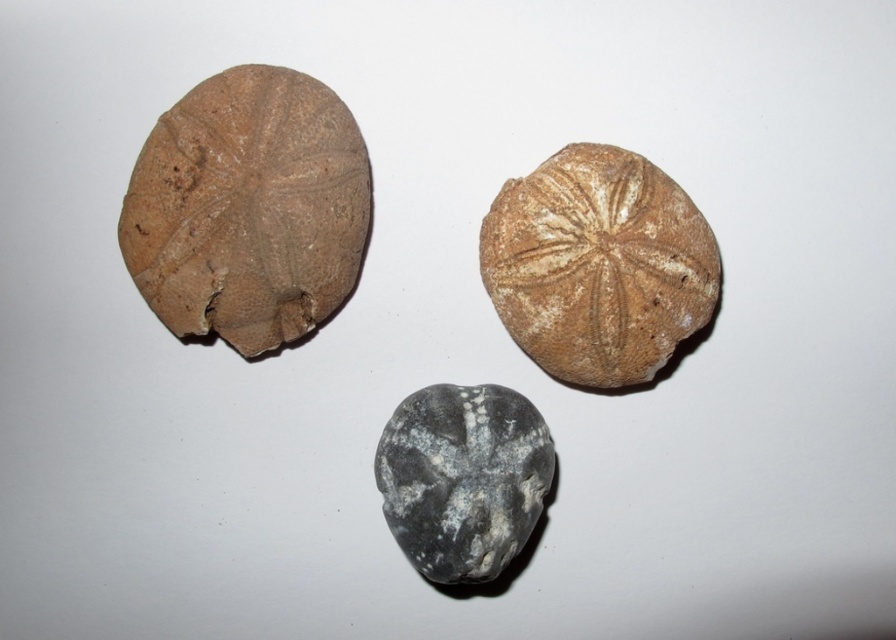
Question: Considering the real-world distances, which object is farthest from the gray matte rock at center?

Choices:
 (A) brown fossilized shell at upper left
 (B) brown textured shell at upper right

Answer: (A)

Question: Can you confirm if brown textured shell at upper right is positioned below gray matte rock at center?

Choices:
 (A) no
 (B) yes

Answer: (A)

Question: Estimate the real-world distances between objects in this image. Which object is closer to the gray matte rock at center?

Choices:
 (A) brown fossilized shell at upper left
 (B) brown textured shell at upper right

Answer: (B)

Question: Which of the following is the farthest from the observer?

Choices:
 (A) brown fossilized shell at upper left
 (B) gray matte rock at center
 (C) brown textured shell at upper right

Answer: (C)

Question: Is brown fossilized shell at upper left smaller than brown textured shell at upper right?

Choices:
 (A) no
 (B) yes

Answer: (A)

Question: Considering the relative positions of brown fossilized shell at upper left and brown textured shell at upper right in the image provided, where is brown fossilized shell at upper left located with respect to brown textured shell at upper right?

Choices:
 (A) left
 (B) right

Answer: (A)